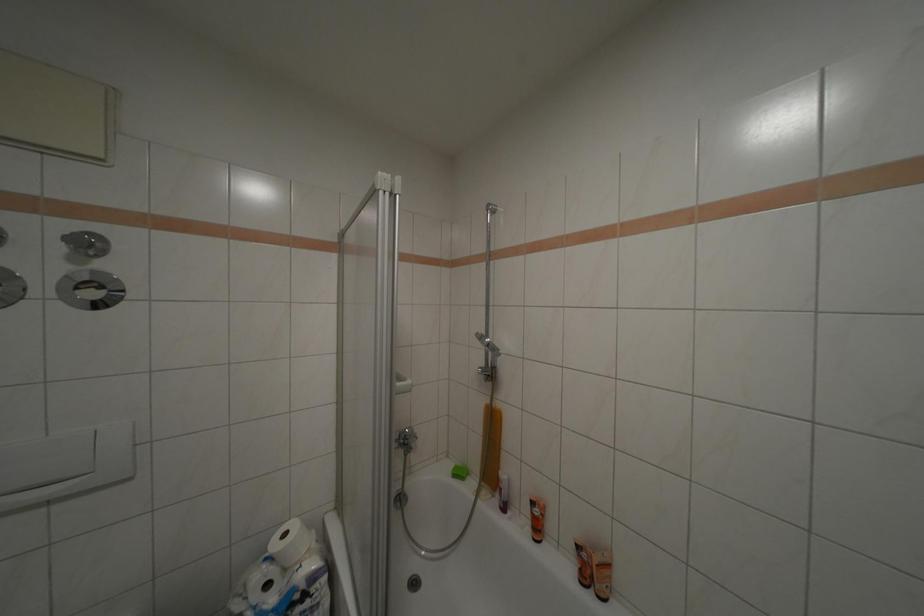
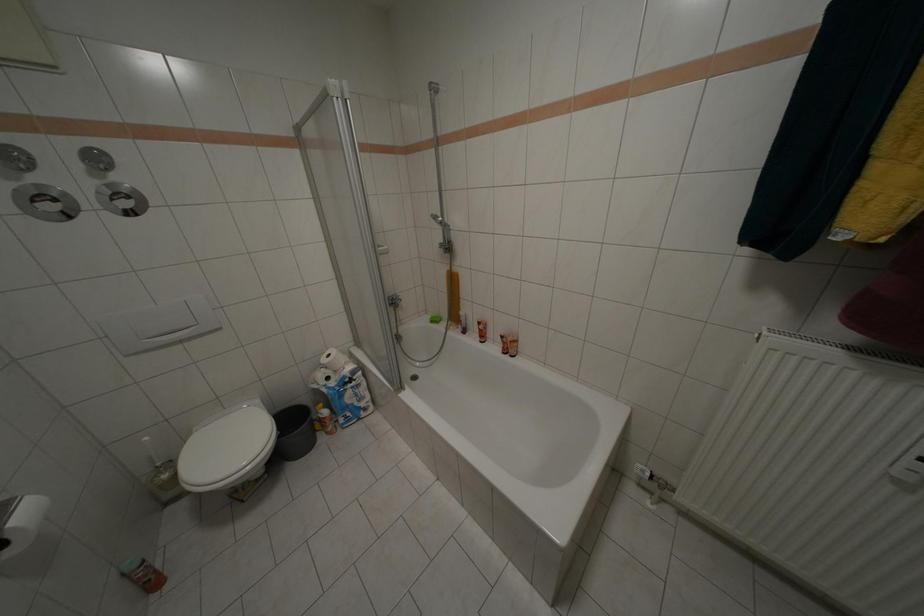
Question: How did the camera likely rotate?

Choices:
 (A) Left
 (B) Right
 (C) Up
 (D) Down

Answer: (D)